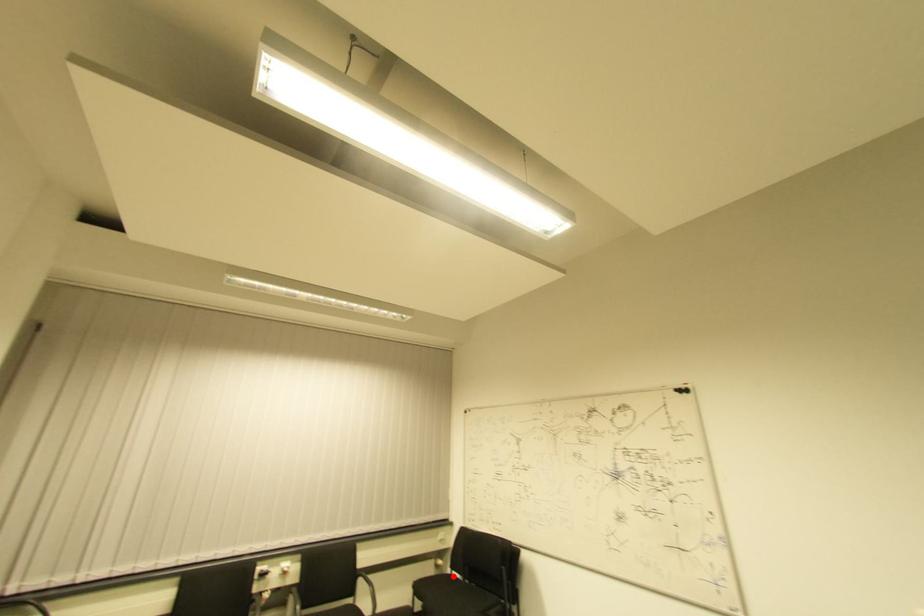
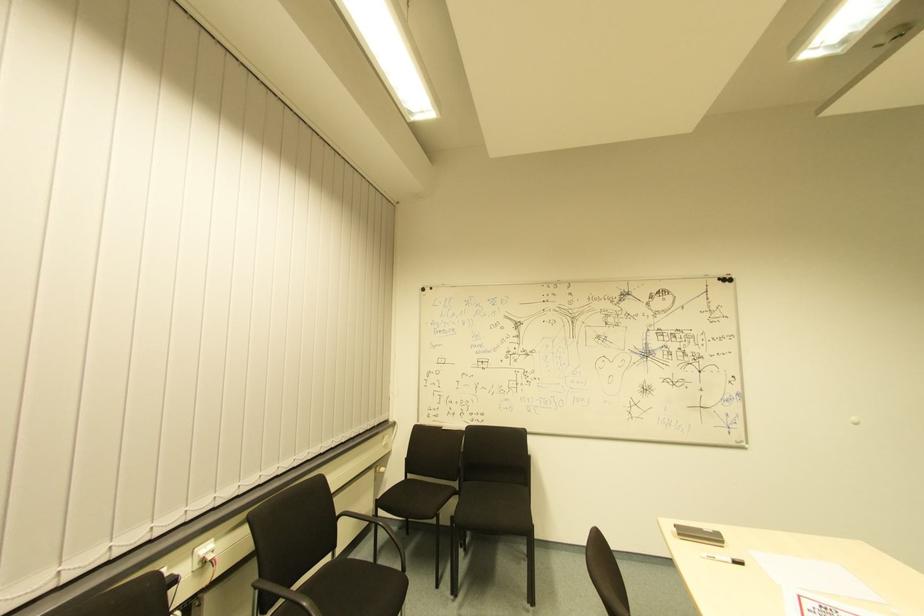
In the second image, find the point that corresponds to the highlighted location in the first image.

(408, 479)